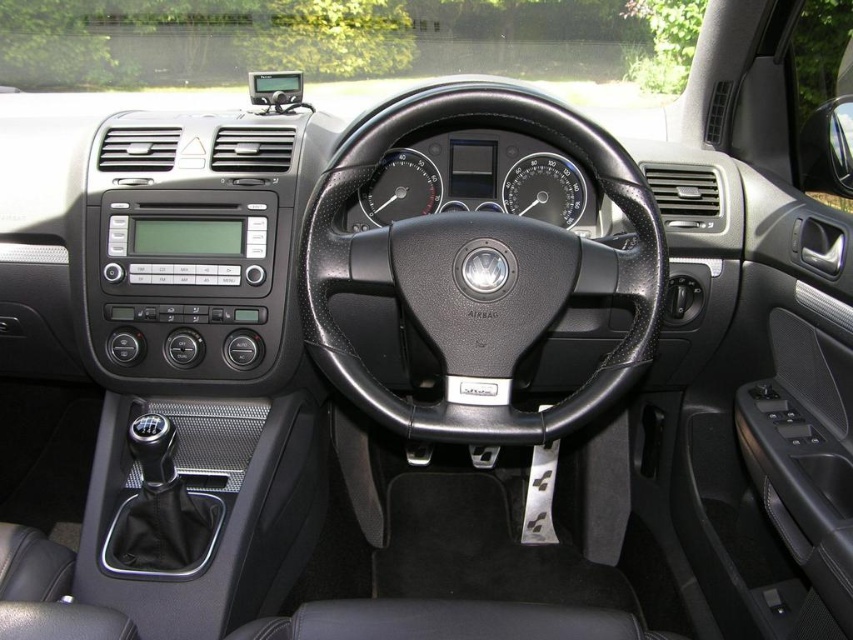
You are sitting in the driver seat of the Volkswagen vehicle. You need to adjust the temperature using the controls. Which object is closer to you that you can reach easily? Please choose between the black leather steering wheel at center and the black plastic speedometer at center.

The black leather steering wheel at center is closer to the viewer than the black plastic speedometer at center, so you can reach it more easily.

Looking at this image, you are sitting in the driver seat of the Volkswagen vehicle. Where is the black plastic speedometer at center located in relation to the steering wheel?

Result: The black plastic speedometer at center is located at point (x=544, y=189) in 2D space, which is to the right of the steering wheel.